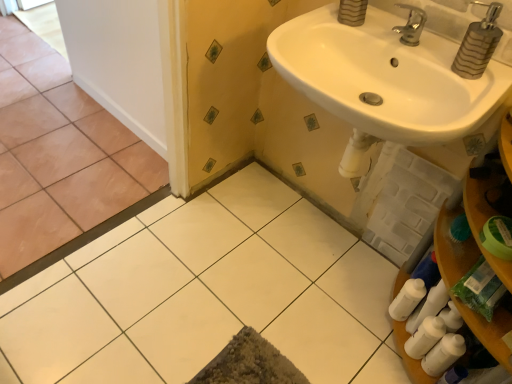
Where is `free spot above white glossy tile at center, the 1th ceramic tile when ordered from right to left (from a real-world perspective)`? The height and width of the screenshot is (384, 512). free spot above white glossy tile at center, the 1th ceramic tile when ordered from right to left (from a real-world perspective) is located at coordinates pos(216,293).